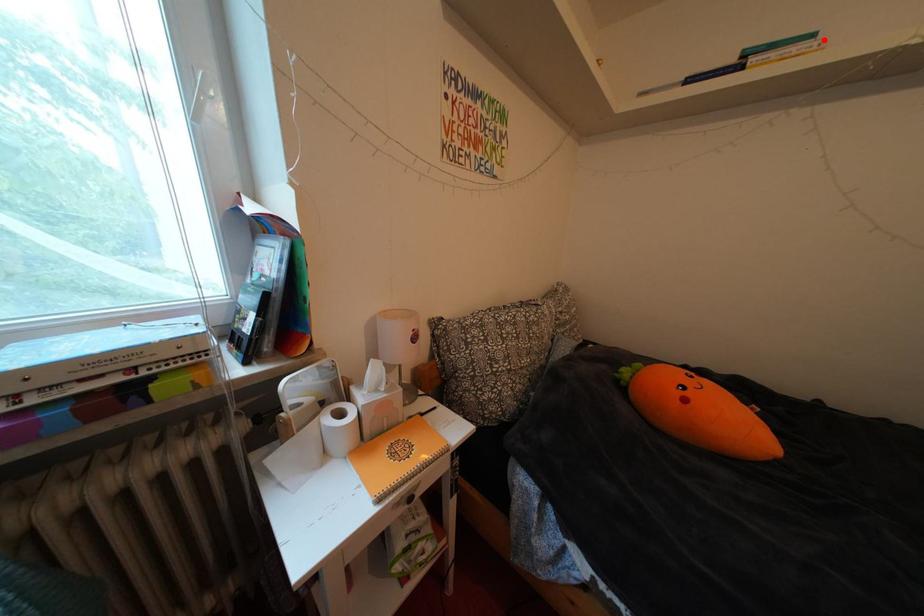
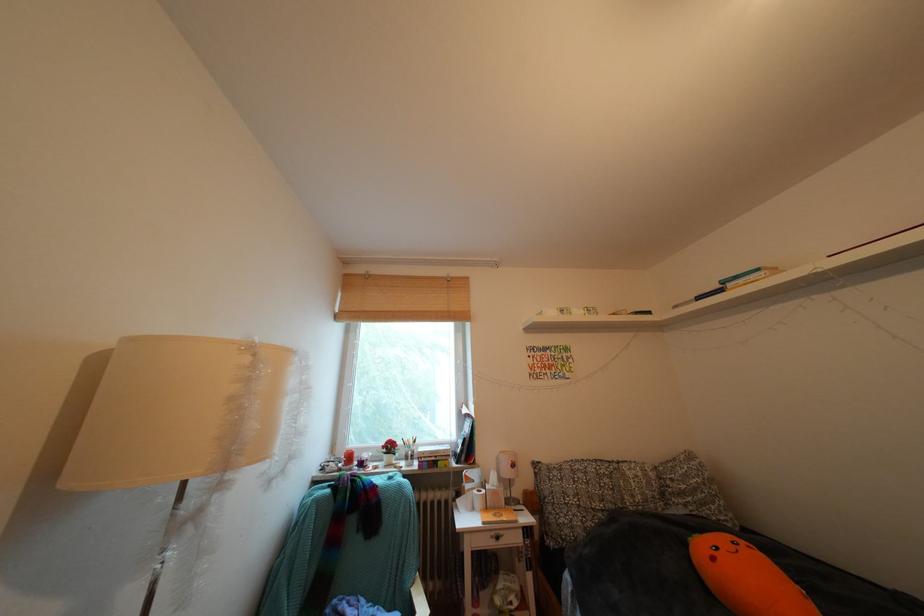
Locate, in the second image, the point that corresponds to the highlighted location in the first image.

(768, 275)